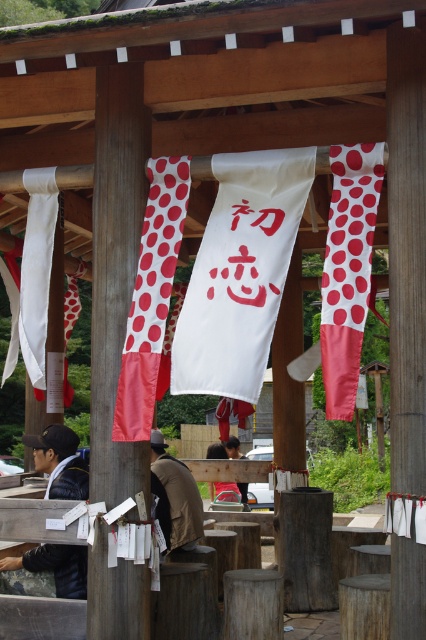
Question: Is white matte banner at left thinner than brown suede jacket at center?

Choices:
 (A) no
 (B) yes

Answer: (B)

Question: Can you confirm if black leather jacket at lower left is positioned above brown leather jacket at center?

Choices:
 (A) no
 (B) yes

Answer: (B)

Question: Which point is closer to the camera?

Choices:
 (A) (83, 269)
 (B) (140, 154)
 (C) (187, 515)
 (D) (331, 376)

Answer: (D)

Question: Estimate the real-world distances between objects in this image. Which object is farther from the white matte banner at left?

Choices:
 (A) white paper banner at center
 (B) brown suede jacket at center
 (C) black leather jacket at lower left

Answer: (B)

Question: Which of the following is the closest to the observer?

Choices:
 (A) (92, 332)
 (B) (37, 248)

Answer: (B)

Question: Does wooden post at center appear on the left side of white satin banner at right?

Choices:
 (A) yes
 (B) no

Answer: (A)